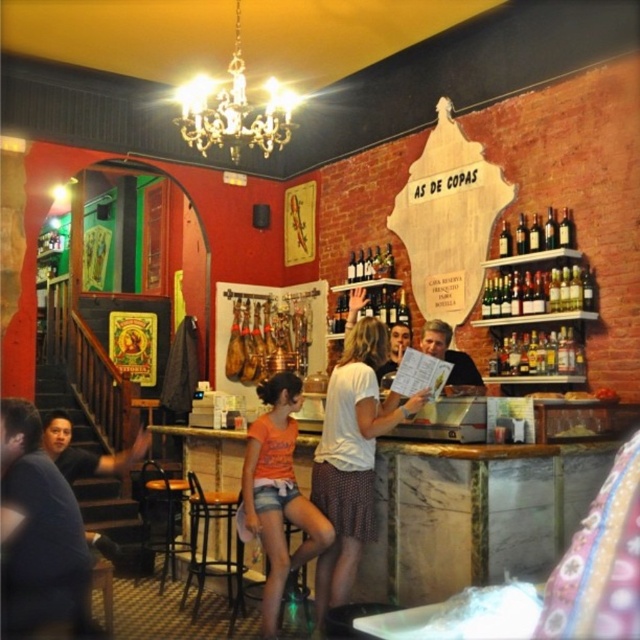
Question: Which point is farther to the camera?

Choices:
 (A) dark blue shirt at lower left
 (B) orange cotton shirt at center
 (C) wooden bar stool at center

Answer: (C)

Question: Can you confirm if dark blue shirt at lower left is wider than white cotton skirt at center?

Choices:
 (A) no
 (B) yes

Answer: (A)

Question: Is translucent glass bottles at upper right in front of matte black shirt at center?

Choices:
 (A) yes
 (B) no

Answer: (B)

Question: Is wooden seat at lower left thinner than matte black shirt at center?

Choices:
 (A) yes
 (B) no

Answer: (B)

Question: Which of the following is the closest to the observer?

Choices:
 (A) (387, 406)
 (B) (394, 348)

Answer: (A)

Question: Among these objects, which one is nearest to the camera?

Choices:
 (A) dark blue shirt at lower left
 (B) dark brown glass bottles at upper right
 (C) shiny gold chandelier at upper center

Answer: (A)